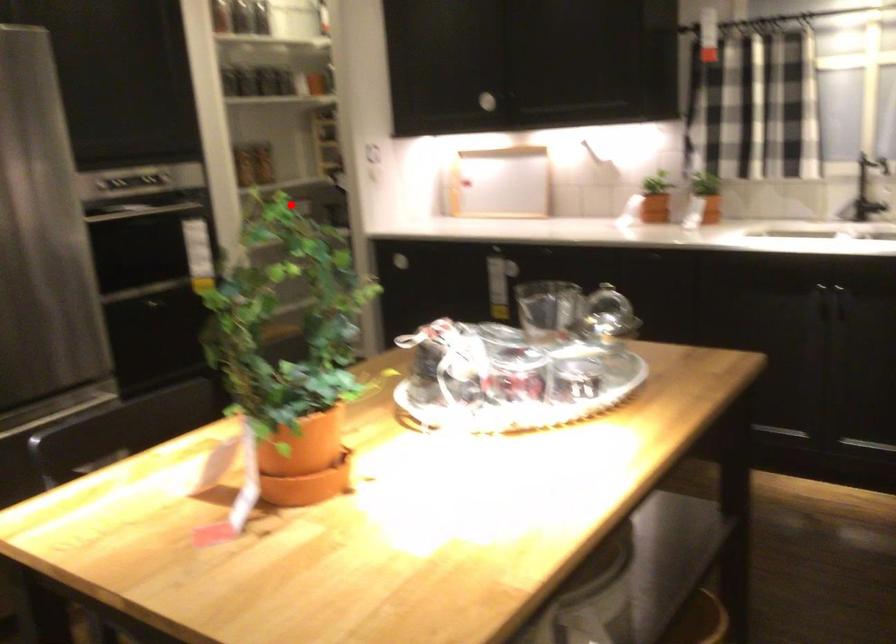
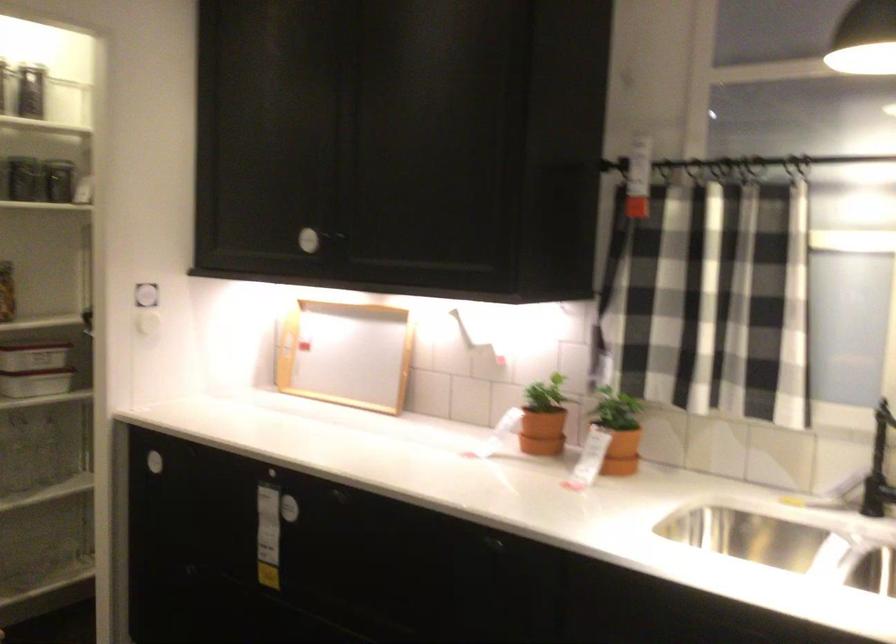
Question: I am providing you with two images of the same scene from different viewpoints. A red point is shown in image1. For the corresponding object point in image2, is it positioned nearer or farther from the camera?

Choices:
 (A) Nearer
 (B) Farther

Answer: (A)